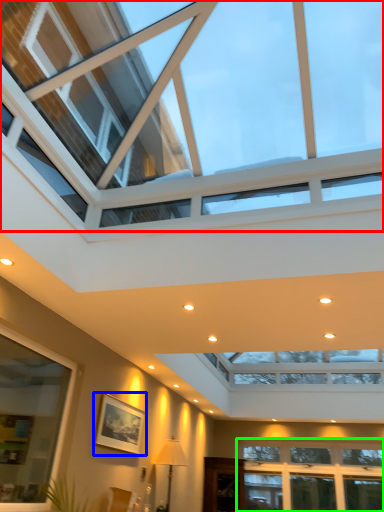
Question: Which object is positioned closest to window (highlighted by a red box)? Select from picture frame (highlighted by a blue box) and window (highlighted by a green box).

Choices:
 (A) picture frame
 (B) window

Answer: (A)